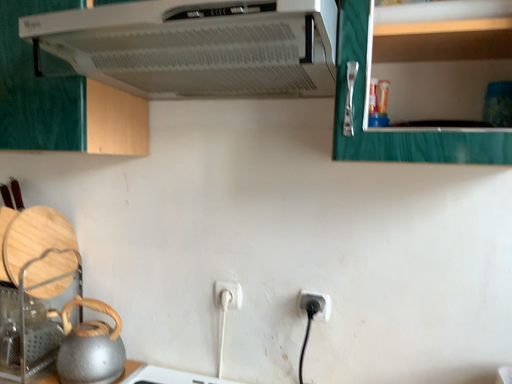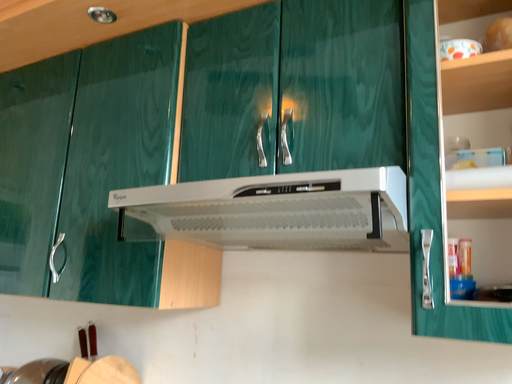
Question: Which way did the camera rotate in the video?

Choices:
 (A) rotated downward
 (B) rotated upward

Answer: (B)